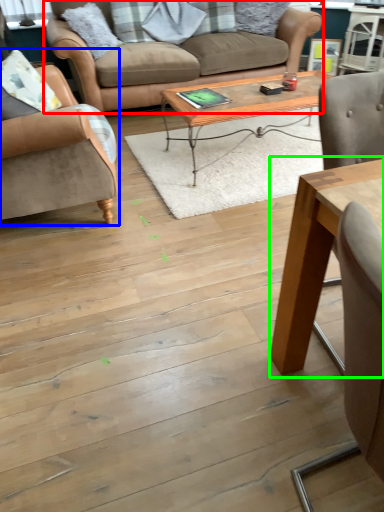
Question: Considering the real-world distances, which object is closest to studio couch (highlighted by a red box)? chair (highlighted by a blue box) or coffee table (highlighted by a green box).

Choices:
 (A) chair
 (B) coffee table

Answer: (A)